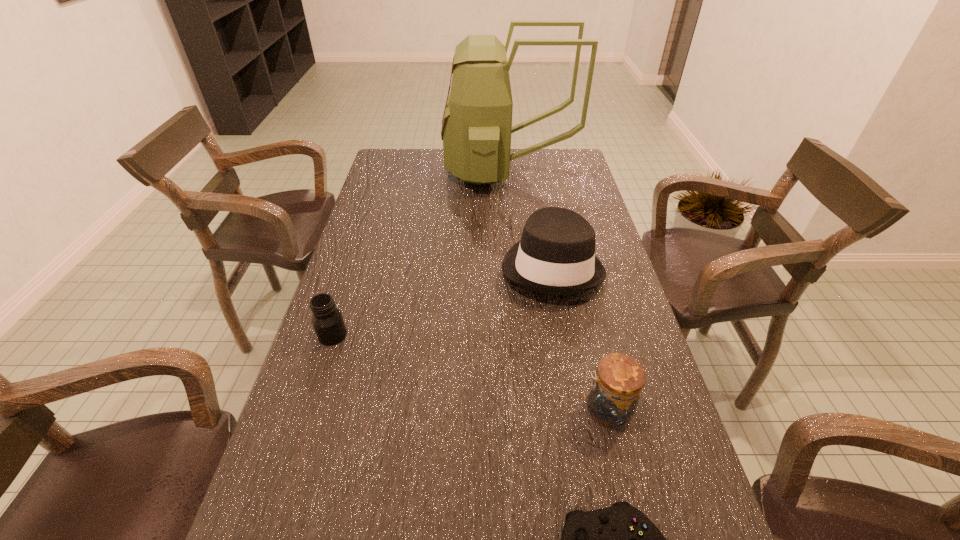
Where is `jar present at the right edge`? The width and height of the screenshot is (960, 540). jar present at the right edge is located at coordinates (618, 381).

At what (x,y) coordinates should I click in order to perform the action: click on object present at the far right corner. Please return your answer as a coordinate pair (x, y). The height and width of the screenshot is (540, 960). Looking at the image, I should click on (476, 130).

The height and width of the screenshot is (540, 960). In the image, there is a desktop. What are the coordinates of `free space at the far edge` in the screenshot? It's located at (522, 158).

Where is `vacant space at the left edge`? Image resolution: width=960 pixels, height=540 pixels. vacant space at the left edge is located at coordinates (360, 245).

At what (x,y) coordinates should I click in order to perform the action: click on vacant space at the right edge of the desktop. Please return your answer as a coordinate pair (x, y). The height and width of the screenshot is (540, 960). Looking at the image, I should click on (597, 329).

The image size is (960, 540). In the image, there is a desktop. Find the location of `free space at the far right corner`. free space at the far right corner is located at coordinates (544, 150).

Locate an element on the screen. free spot between the left jar and the backpack is located at coordinates (420, 253).

Identify the location of empty space between the third farthest object and the nearer jar. The height and width of the screenshot is (540, 960). (469, 372).

The width and height of the screenshot is (960, 540). In order to click on object that is the fourth closest to the farthest object in this screenshot , I will do `click(620, 539)`.

The height and width of the screenshot is (540, 960). Identify the location of object that stands as the closest to the backpack. (556, 254).